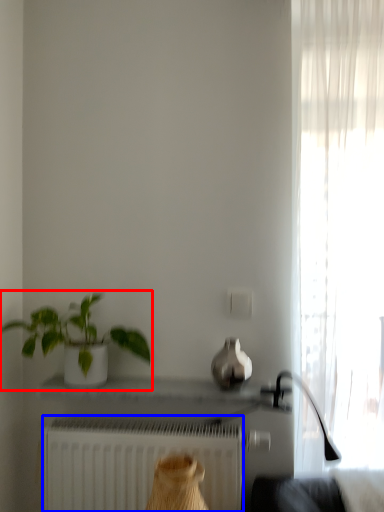
Question: Among these objects, which one is farthest to the camera, houseplant (highlighted by a red box) or radiator (highlighted by a blue box)?

Choices:
 (A) houseplant
 (B) radiator

Answer: (B)